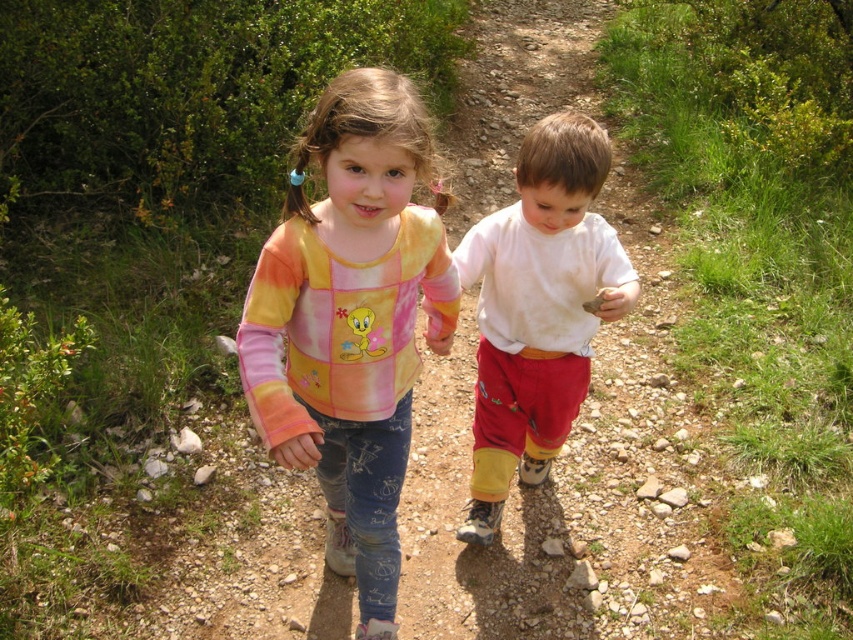
Can you confirm if dirt track at center is bigger than tie-dye fabric shirt at center?

Incorrect, dirt track at center is not larger than tie-dye fabric shirt at center.

Is dirt track at center to the right of tie-dye fabric shirt at center from the viewer's perspective?

Correct, you'll find dirt track at center to the right of tie-dye fabric shirt at center.

Is point (442, 429) behind point (323, 134)?

Yes, point (442, 429) is farther from viewer.

Find the location of a particular element. Image resolution: width=853 pixels, height=640 pixels. dirt track at center is located at coordinates (575, 490).

Can you confirm if tie-dye fabric shirt at center is wider than white cotton shirt at center?

In fact, tie-dye fabric shirt at center might be narrower than white cotton shirt at center.

Between point (389, 554) and point (573, 195), which one is positioned in front?

Point (573, 195) is more forward.

Is point (386, 564) behind point (538, 417)?

No.

Where is `tie-dye fabric shirt at center`? tie-dye fabric shirt at center is located at coordinates (351, 321).

What do you see at coordinates (575, 490) in the screenshot?
I see `dirt track at center` at bounding box center [575, 490].

Does point (271, 621) come in front of point (503, 420)?

Yes.

Who is more forward, [412,513] or [558,276]?

Point [558,276] is in front.

At what (x,y) coordinates should I click in order to perform the action: click on dirt track at center. Please return your answer as a coordinate pair (x, y). The width and height of the screenshot is (853, 640). Looking at the image, I should click on (575, 490).